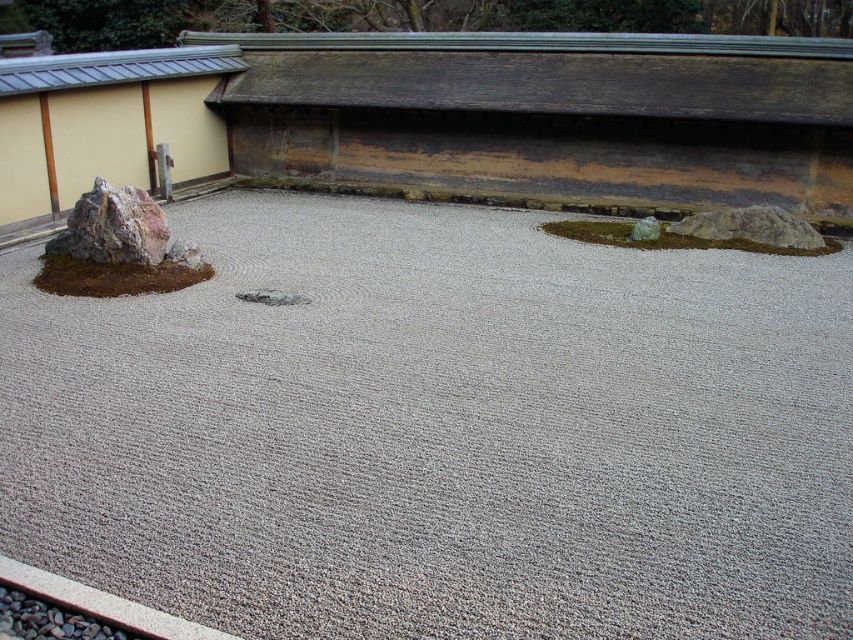
You are a gardener who wants to place a new decorative item in the Japanese rock garden. The item is 10 cm tall. You have two options for placement locations based on the existing elements. The first option is near the gray gravel at center, and the second option is near the gray rough rock at right. Which location would allow the item to be visible above the existing elements?

The gray gravel at center is taller than the gray rough rock at right. Therefore, placing the item near the gray rough rock at right would allow it to be visible above the existing elements since it is shorter than the gravel.

You are a gardener who wants to place a small decorative stone in the Japanese rock garden. The garden has gray gravel at center. According to the garden design principles, you should place the stone in an area that is not already occupied by the gravel. Where would you place the stone?

Since the gray gravel at center is located at point (439, 429), you should place the stone in an area not occupied by the gravel, such as near the edges or other features like the mossy area or the large rock in the upper left corner.